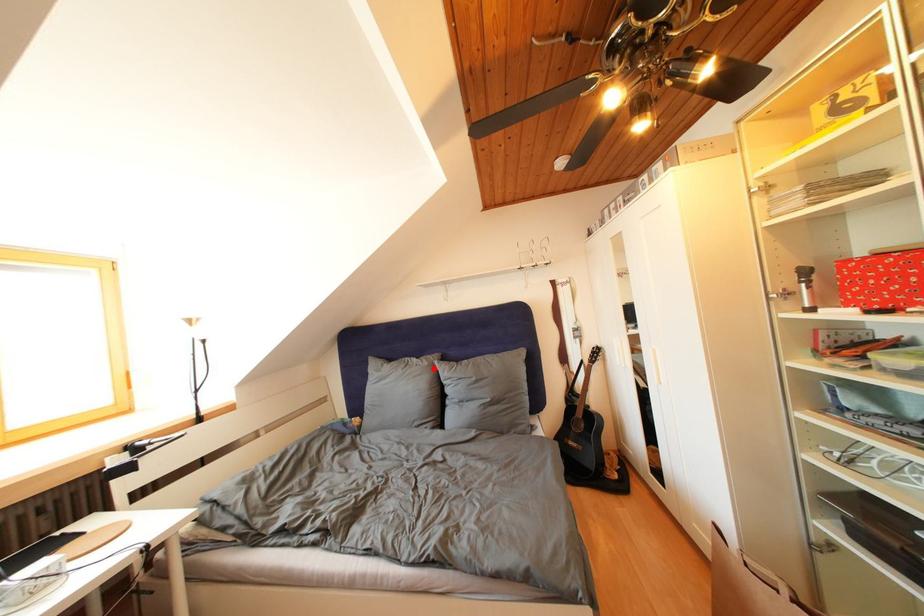
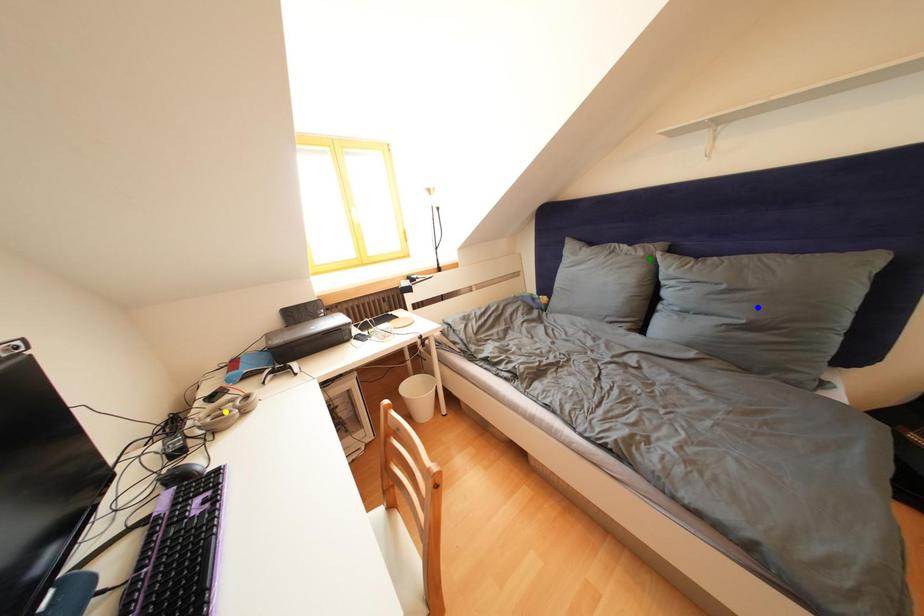
Question: I am providing you with two images of the same scene from different viewpoints. A red point is marked on the first image. You are given multiple points on the second image. In image 2, which mark is for the same physical point as the one in image 1?

Choices:
 (A) green point
 (B) blue point
 (C) yellow point

Answer: (A)